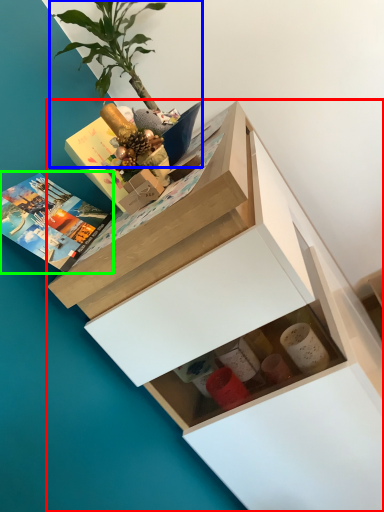
Question: Which object is positioned farthest from chest of drawers (highlighted by a red box)? Select from houseplant (highlighted by a blue box) and book (highlighted by a green box).

Choices:
 (A) houseplant
 (B) book

Answer: (A)